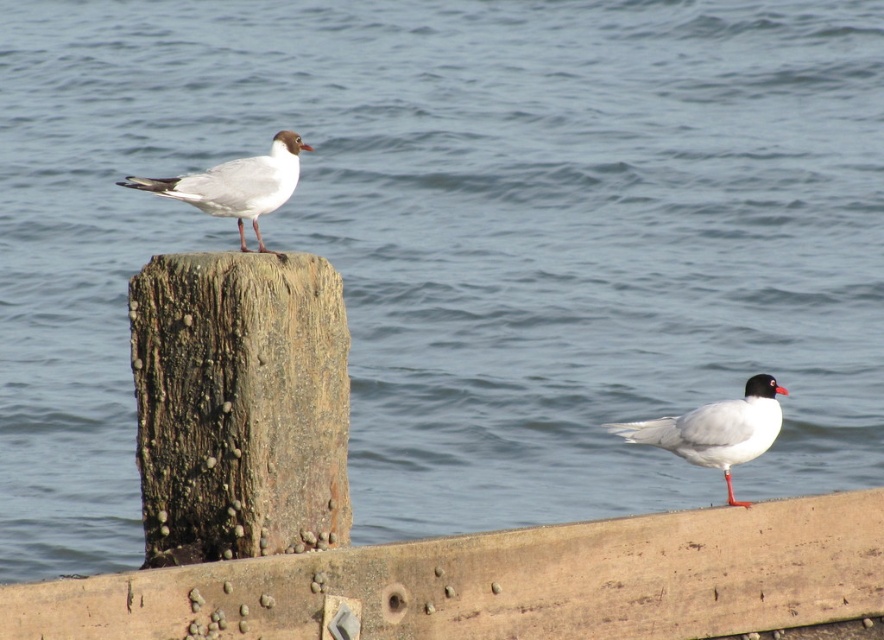
You are a photographer standing at the camera position. You want to capture a closeup shot of the white matte bird at lower right. Given that your telephoto lens can focus on subjects within 5 meters, will you need to adjust your position to get a clear closeup?

The white matte bird at lower right is 8.09 meters away from the camera, which is beyond the telephoto lens focus range of 5 meters. You will need to move closer to the bird to ensure it is within the 5 meter range for a clear closeup.

You are standing on the weathered wood dock at lower center and want to reach the weathered wood post at center. Which direction should you move to get closer to the post?

The weathered wood dock at lower center is in front of the weathered wood post at center, so you are already in front of the post. To reach it, you should move backward away from the dock towards the post.